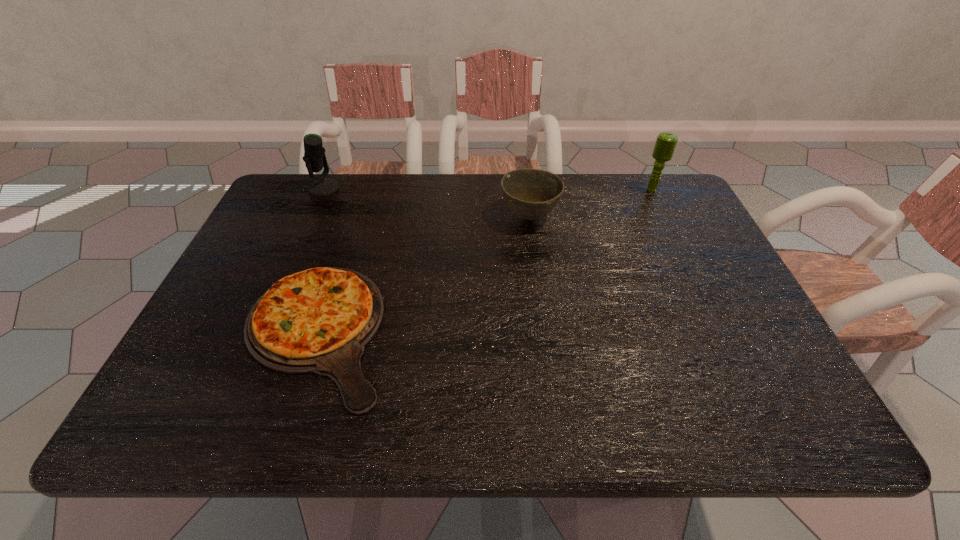
Where is `bowl positioned at the far edge`? The image size is (960, 540). bowl positioned at the far edge is located at coordinates (531, 193).

This screenshot has height=540, width=960. Find the location of `object present at the near edge`. object present at the near edge is located at coordinates (319, 320).

Image resolution: width=960 pixels, height=540 pixels. Identify the location of microphone at the left edge. (314, 157).

The image size is (960, 540). Find the location of `pizza at the left edge`. pizza at the left edge is located at coordinates (319, 320).

Where is `object present at the right edge`? This screenshot has height=540, width=960. object present at the right edge is located at coordinates (666, 142).

Where is `object at the far left corner`? The image size is (960, 540). object at the far left corner is located at coordinates (314, 157).

Find the location of a particular element. The width and height of the screenshot is (960, 540). object positioned at the near left corner is located at coordinates (319, 320).

At what (x,y) coordinates should I click in order to perform the action: click on object located at the far right corner. Please return your answer as a coordinate pair (x, y). Looking at the image, I should click on (666, 142).

Locate an element on the screen. vacant space at the far edge of the desktop is located at coordinates (434, 191).

Find the location of `vacant space at the left edge`. vacant space at the left edge is located at coordinates (266, 242).